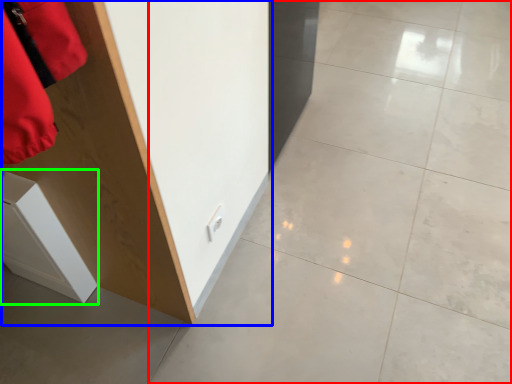
Question: Which is nearer to the concrete (highlighted by a red box)? furniture (highlighted by a blue box) or cabinetry (highlighted by a green box).

Choices:
 (A) furniture
 (B) cabinetry

Answer: (A)